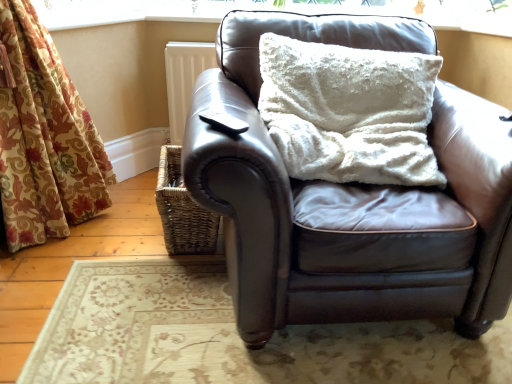
I want to click on woven brown basket at lower left, so tap(182, 210).

The image size is (512, 384). Identify the location of white fluffy pillow at upper center. (349, 112).

What is the approximate height of white fluffy pillow at upper center?

white fluffy pillow at upper center is 17.00 inches tall.

Identify the location of woven brown basket at lower left. This screenshot has height=384, width=512. (182, 210).

From the image's perspective, would you say woven brown basket at lower left is shown under white textured cushion at upper center?

Indeed, from the image's perspective, woven brown basket at lower left is shown beneath white textured cushion at upper center.

Can you confirm if woven brown basket at lower left is smaller than white textured cushion at upper center?

Yes.

From a real-world perspective, is woven brown basket at lower left above or below white textured cushion at upper center?

From a real-world perspective, woven brown basket at lower left is physically below white textured cushion at upper center.

Are woven brown basket at lower left and white textured cushion at upper center located far from each other?

That's not correct — woven brown basket at lower left is a little close to white textured cushion at upper center.

Is white textured cushion at upper center shorter than white fluffy pillow at upper center?

Yes, white textured cushion at upper center is shorter than white fluffy pillow at upper center.

Is white textured cushion at upper center beside white fluffy pillow at upper center?

white textured cushion at upper center and white fluffy pillow at upper center are not in contact.

Is white fluffy pillow at upper center completely or partially inside white textured cushion at upper center?

No, white fluffy pillow at upper center is located outside of white textured cushion at upper center.

Considering the relative sizes of white textured cushion at upper center and white fluffy pillow at upper center in the image provided, is white textured cushion at upper center smaller than white fluffy pillow at upper center?

Correct, white textured cushion at upper center occupies less space than white fluffy pillow at upper center.

From the image's perspective, is black matte remote control at upper center below white fluffy pillow at upper center?

Correct, black matte remote control at upper center appears lower than white fluffy pillow at upper center in the image.

Is white fluffy pillow at upper center located within black matte remote control at upper center?

That's incorrect, white fluffy pillow at upper center is not inside black matte remote control at upper center.

Considering the relative positions of black matte remote control at upper center and white fluffy pillow at upper center in the image provided, is black matte remote control at upper center to the right of white fluffy pillow at upper center from the viewer's perspective?

No.

Which of these two, white textured cushion at upper center or matte brown leather couch at center, is smaller?

Smaller between the two is white textured cushion at upper center.

Is white textured cushion at upper center positioned behind matte brown leather couch at center?

Yes.

Is white textured cushion at upper center spatially inside matte brown leather couch at center, or outside of it?

white textured cushion at upper center is not inside matte brown leather couch at center, it's outside.

Considering the sizes of objects white textured cushion at upper center and matte brown leather couch at center in the image provided, who is thinner, white textured cushion at upper center or matte brown leather couch at center?

white textured cushion at upper center.

From the image's perspective, is black matte remote control at upper center located above or below white textured cushion at upper center?

Based on their image positions, black matte remote control at upper center is located beneath white textured cushion at upper center.

Who is taller, black matte remote control at upper center or white textured cushion at upper center?

With more height is white textured cushion at upper center.

Is point (216, 116) closer or farther from the camera than point (323, 2)?

Point (216, 116).

Is black matte remote control at upper center surrounding white textured cushion at upper center?

That's incorrect, white textured cushion at upper center is not inside black matte remote control at upper center.

From the picture: Could you tell me if matte brown leather couch at center is turned towards white fluffy pillow at upper center?

Yes, matte brown leather couch at center faces towards white fluffy pillow at upper center.

Is white fluffy pillow at upper center surrounded by matte brown leather couch at center?

Yes.

Which object is positioned more to the left, matte brown leather couch at center or white fluffy pillow at upper center?

matte brown leather couch at center.

Locate an element on the screen. pillow on the right of the matte brown leather couch at center is located at coordinates (349, 112).

Does point (236, 119) come in front of point (186, 196)?

Yes.

Considering the sizes of objects black matte remote control at upper center and woven brown basket at lower left in the image provided, who is smaller, black matte remote control at upper center or woven brown basket at lower left?

Smaller between the two is black matte remote control at upper center.

Is black matte remote control at upper center looking in the opposite direction of woven brown basket at lower left?

No, black matte remote control at upper center is not facing the opposite direction of woven brown basket at lower left.

The width and height of the screenshot is (512, 384). Find the location of `window frame behind the woven brown basket at lower left`. window frame behind the woven brown basket at lower left is located at coordinates (136, 11).

Image resolution: width=512 pixels, height=384 pixels. I want to click on pillow that is in front of the white textured cushion at upper center, so click(349, 112).

Estimate the real-world distances between objects in this image. Which object is closer to black matte remote control at upper center, white textured cushion at upper center or white fluffy pillow at upper center?

white fluffy pillow at upper center is closer to black matte remote control at upper center.

Based on their spatial positions, is white fluffy pillow at upper center or matte brown leather couch at center closer to black matte remote control at upper center?

The object closer to black matte remote control at upper center is matte brown leather couch at center.

Looking at this image, which object lies nearer to the anchor point white textured cushion at upper center, black matte remote control at upper center or white fluffy pillow at upper center?

Based on the image, white fluffy pillow at upper center appears to be nearer to white textured cushion at upper center.

Estimate the real-world distances between objects in this image. Which object is closer to white fluffy pillow at upper center, matte brown leather couch at center or black matte remote control at upper center?

matte brown leather couch at center.

Based on their spatial positions, is woven brown basket at lower left or white fluffy pillow at upper center further from white textured cushion at upper center?

white fluffy pillow at upper center lies further to white textured cushion at upper center than the other object.

Looking at this image, based on their spatial positions, is black matte remote control at upper center or woven brown basket at lower left further from white fluffy pillow at upper center?

woven brown basket at lower left.

Looking at the image, which one is located further to woven brown basket at lower left, matte brown leather couch at center or white fluffy pillow at upper center?

Based on the image, matte brown leather couch at center appears to be further to woven brown basket at lower left.

Which object lies nearer to the anchor point black matte remote control at upper center, white fluffy pillow at upper center or woven brown basket at lower left?

white fluffy pillow at upper center.

Locate an element on the screen. basket between black matte remote control at upper center and white textured cushion at upper center along the z-axis is located at coordinates (182, 210).

Where is `studio couch between black matte remote control at upper center and white fluffy pillow at upper center from left to right`? studio couch between black matte remote control at upper center and white fluffy pillow at upper center from left to right is located at coordinates (352, 199).

Find the location of `basket between white fluffy pillow at upper center and white textured cushion at upper center from front to back`. basket between white fluffy pillow at upper center and white textured cushion at upper center from front to back is located at coordinates (182, 210).

At what (x,y) coordinates should I click in order to perform the action: click on pillow located between black matte remote control at upper center and white textured cushion at upper center in the depth direction. Please return your answer as a coordinate pair (x, y). The width and height of the screenshot is (512, 384). Looking at the image, I should click on (349, 112).